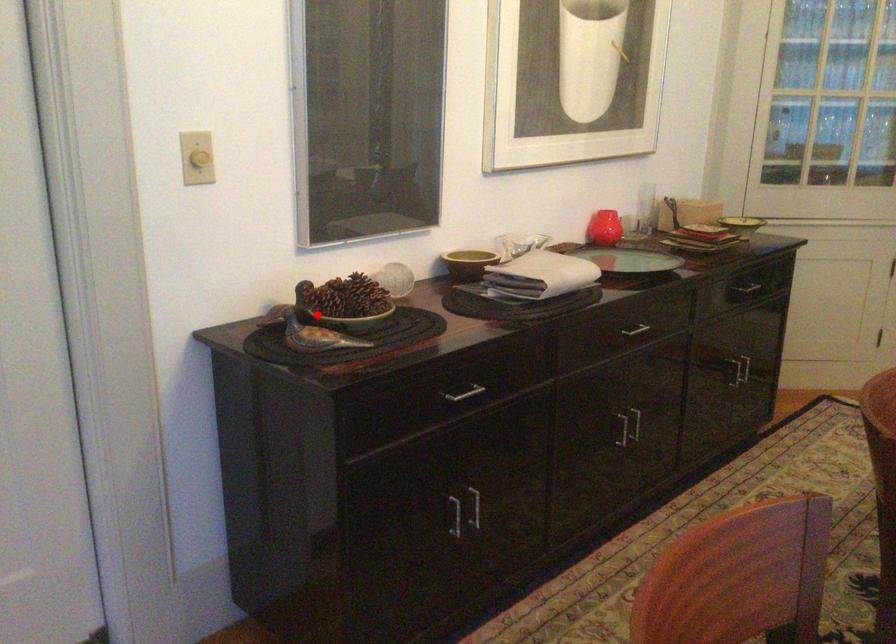
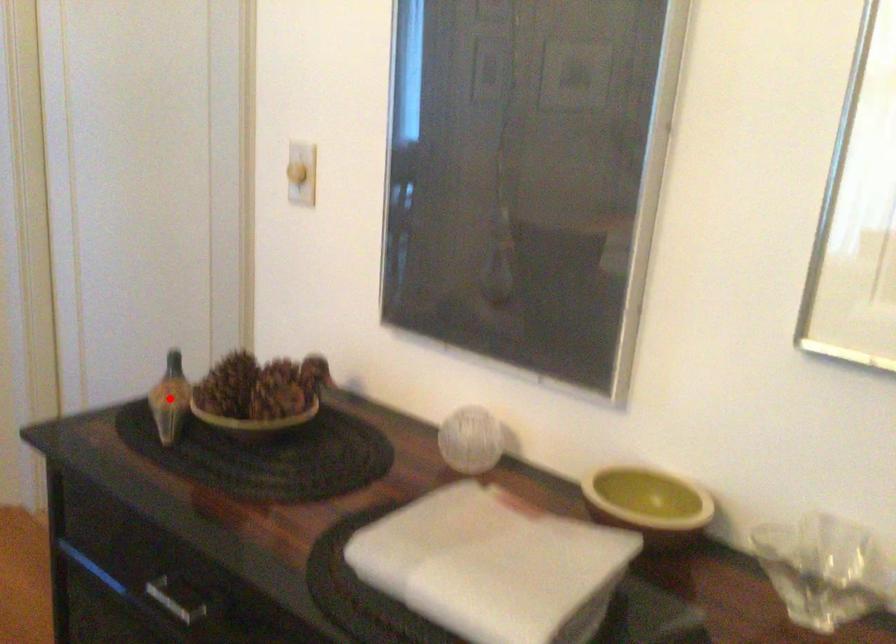
I am providing you with two images of the same scene from different viewpoints. A red point is marked on the first image and another point is marked on the second image. Does the point marked in image1 correspond to the same location as the one in image2?

Yes